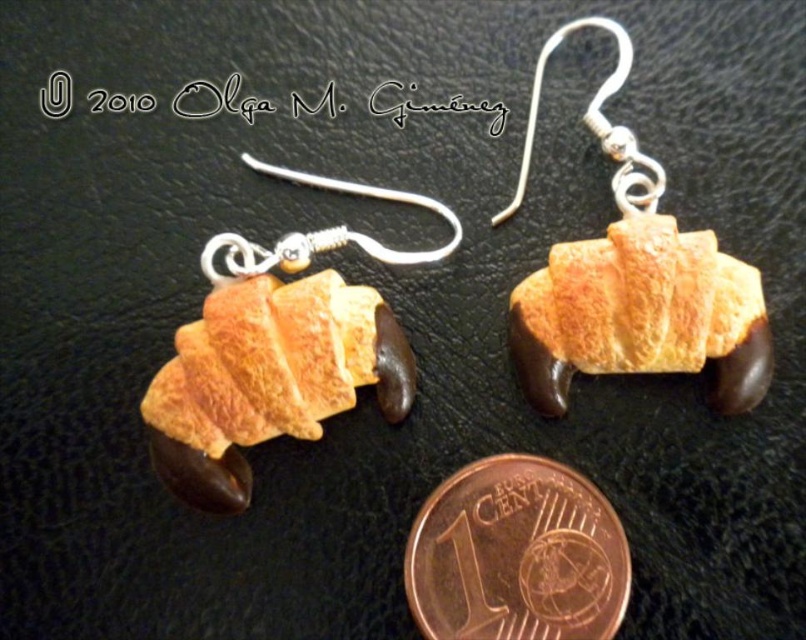
Can you confirm if copper metallic coin at lower center is shorter than silver/textured hook at upper left?

No, copper metallic coin at lower center is not shorter than silver/textured hook at upper left.

Can you confirm if copper metallic coin at lower center is smaller than silver/textured hook at upper left?

No, copper metallic coin at lower center is not smaller than silver/textured hook at upper left.

At what (x,y) coordinates should I click in order to perform the action: click on copper metallic coin at lower center. Please return your answer as a coordinate pair (x, y). Image resolution: width=806 pixels, height=640 pixels. Looking at the image, I should click on (516, 556).

Is golden matte croissant at center further to camera compared to silver/textured hook at upper left?

No, it is not.

Is golden matte croissant at center wider than silver/textured hook at upper left?

In fact, golden matte croissant at center might be narrower than silver/textured hook at upper left.

Locate an element on the screen. The image size is (806, 640). golden matte croissant at center is located at coordinates (634, 282).

Locate an element on the screen. The width and height of the screenshot is (806, 640). golden matte croissant at center is located at coordinates (634, 282).

Which of these two, golden matte croissant at center or copper metallic coin at lower center, stands shorter?

copper metallic coin at lower center is shorter.

Based on the photo, can you confirm if golden matte croissant at center is bigger than copper metallic coin at lower center?

Correct, golden matte croissant at center is larger in size than copper metallic coin at lower center.

What do you see at coordinates (634, 282) in the screenshot? I see `golden matte croissant at center` at bounding box center [634, 282].

The height and width of the screenshot is (640, 806). I want to click on golden matte croissant at center, so click(x=634, y=282).